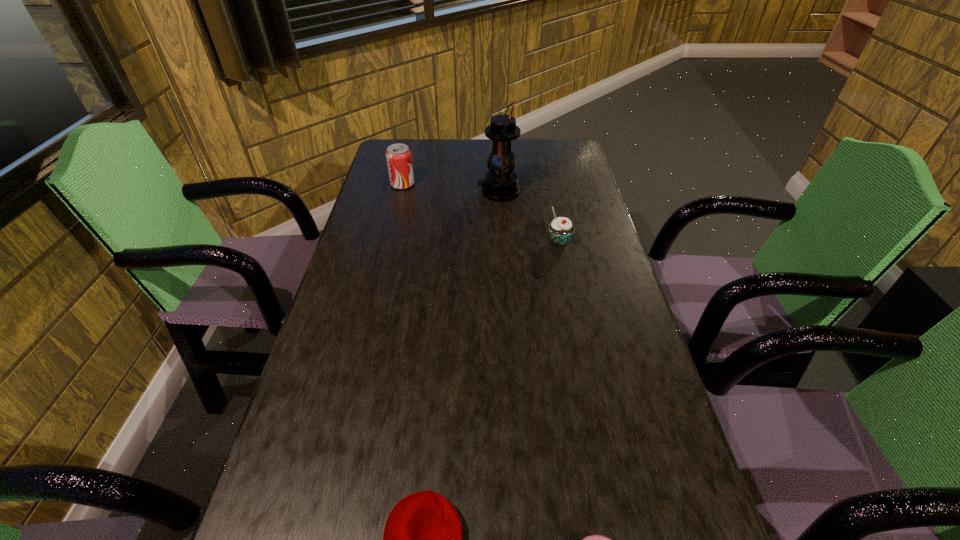
Locate an element on the screen. The height and width of the screenshot is (540, 960). the tallest object is located at coordinates (501, 183).

Locate an element on the screen. the third object from right to left is located at coordinates (501, 183).

The image size is (960, 540). Identify the location of the fourth shortest object. (399, 160).

Locate an element on the screen. Image resolution: width=960 pixels, height=540 pixels. the leftmost object is located at coordinates (399, 160).

The width and height of the screenshot is (960, 540). Find the location of `cupcake`. cupcake is located at coordinates (561, 229).

Locate an element on the screen. the third tallest object is located at coordinates (561, 229).

Point to a free spot located above the third object from left to right, indicating its light source. Please provide its 2D coordinates. Your answer should be formatted as a tuple, i.e. [(x, y)], where the tuple contains the x and y coordinates of a point satisfying the conditions above.

[(457, 191)]

What is the location of a free spot located 0.220m above the third object from left to right, indicating its light source? Please provide its 2D coordinates. Your answer should be formatted as a tuple, i.e. [(x, y)], where the tuple contains the x and y coordinates of a point satisfying the conditions above.

[(414, 191)]

Find a few locations in blank space located 0.130m above the third object from left to right, indicating its light source. Please provide its 2D coordinates. Your answer should be formatted as a tuple, i.e. [(x, y)], where the tuple contains the x and y coordinates of a point satisfying the conditions above.

[(440, 191)]

The height and width of the screenshot is (540, 960). Find the location of `vacant space situated on the front of the soda can`. vacant space situated on the front of the soda can is located at coordinates (396, 213).